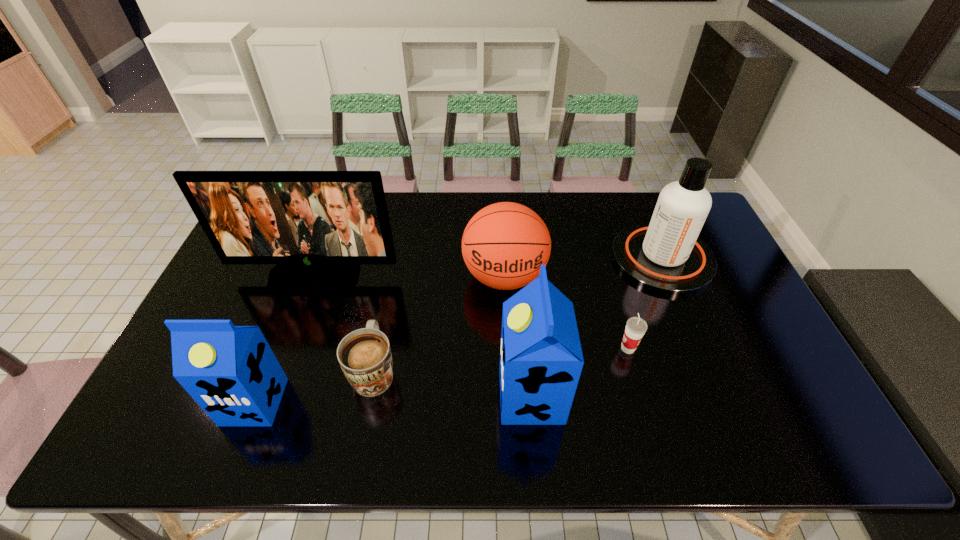
This screenshot has width=960, height=540. I want to click on vacant space situated on the side with logo of the basketball, so click(x=510, y=378).

Locate an element on the screen. This screenshot has width=960, height=540. blank space located 0.140m on the front-facing side of the monitor is located at coordinates (298, 323).

Where is `free space located 0.160m on the front of the rightmost object`? The width and height of the screenshot is (960, 540). free space located 0.160m on the front of the rightmost object is located at coordinates (696, 340).

Find the location of a particular element. This screenshot has height=540, width=960. free space located on the side of the sixth object from left to right with the logo is located at coordinates (543, 348).

Identify the location of free space located on the side of the sixth object from left to right with the logo. This screenshot has width=960, height=540. (569, 348).

The width and height of the screenshot is (960, 540). Find the location of `vacant area located on the side of the sixth object from left to right with the logo`. vacant area located on the side of the sixth object from left to right with the logo is located at coordinates (600, 348).

Where is `vacant space located 0.370m on the side of the mug with the handle`? vacant space located 0.370m on the side of the mug with the handle is located at coordinates (397, 249).

This screenshot has width=960, height=540. Identify the location of vacant space situated 0.220m on the side of the mug with the handle. (391, 283).

The image size is (960, 540). Identify the location of free space located 0.330m on the side of the mug with the handle. (396, 258).

Where is `object positioned at the far edge`? The image size is (960, 540). object positioned at the far edge is located at coordinates (666, 256).